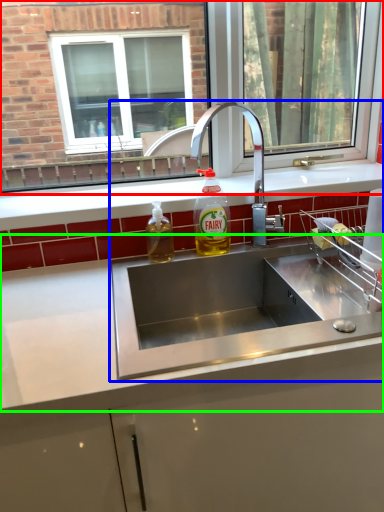
Question: Estimate the real-world distances between objects in this image. Which object is farther from window (highlighted by a red box), sink (highlighted by a blue box) or countertop (highlighted by a green box)?

Choices:
 (A) sink
 (B) countertop

Answer: (B)